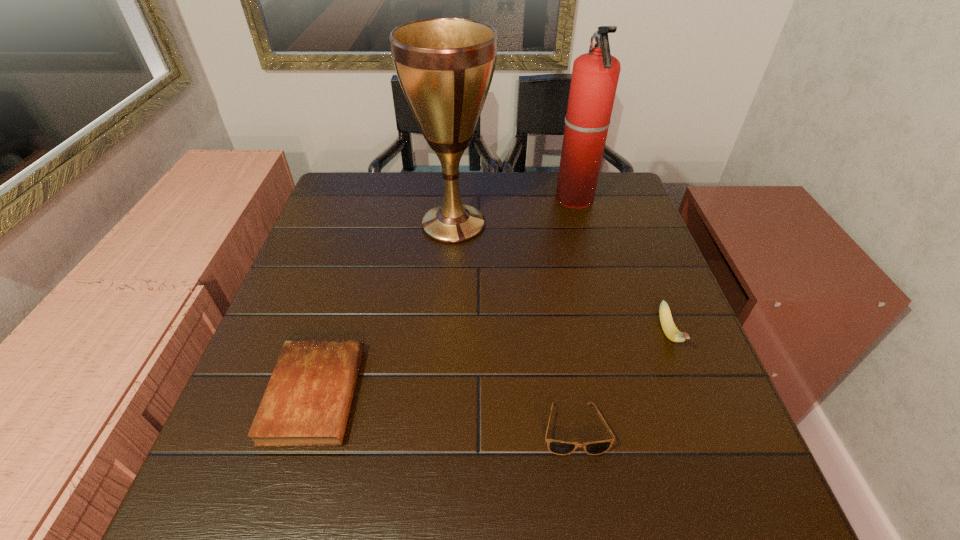
I want to click on free space between the banana and the sunglasses, so click(621, 381).

Where is `vacant space that's between the sunglasses and the trophy cup`? This screenshot has width=960, height=540. vacant space that's between the sunglasses and the trophy cup is located at coordinates (x=514, y=326).

Locate an element on the screen. vacant area between the Bible and the fire extinguisher is located at coordinates (444, 296).

Find the location of `vacant space that's between the fire extinguisher and the sunglasses`. vacant space that's between the fire extinguisher and the sunglasses is located at coordinates (574, 314).

This screenshot has height=540, width=960. I want to click on empty space that is in between the Bible and the trophy cup, so click(384, 309).

Where is `free space between the Bible and the sunglasses`? free space between the Bible and the sunglasses is located at coordinates (444, 411).

Choose which object is the third nearest neighbor to the trophy cup. Please provide its 2D coordinates. Your answer should be formatted as a tuple, i.e. [(x, y)], where the tuple contains the x and y coordinates of a point satisfying the conditions above.

[(667, 323)]

Identify which object is located as the third nearest to the fire extinguisher. Please provide its 2D coordinates. Your answer should be formatted as a tuple, i.e. [(x, y)], where the tuple contains the x and y coordinates of a point satisfying the conditions above.

[(557, 447)]

What are the coordinates of `vacant space that satisfies the following two spatial constraints: 1. on the front side of the second object from left to right; 2. on the spine side of the Bible` in the screenshot? It's located at (442, 394).

The width and height of the screenshot is (960, 540). In order to click on free location that satisfies the following two spatial constraints: 1. with the nozzle and gauge on the fire extinguisher; 2. on the frames of the sunglasses in this screenshot , I will do `click(637, 429)`.